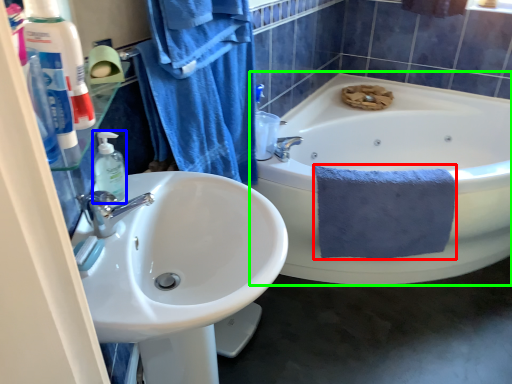
Question: Which object is the closest to the bath towel (highlighted by a red box)? Choose among these: soap dispenser (highlighted by a blue box) or bathtub (highlighted by a green box).

Choices:
 (A) soap dispenser
 (B) bathtub

Answer: (B)